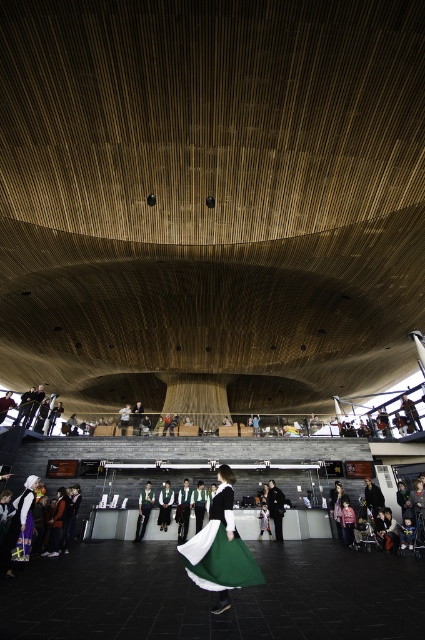
You are a fashion designer attending a presentation where two dresses are displayed at the center of an architectural space with a wooden slatted dome ceiling. The green satin dress at center and the matte black dress at center are both on display. Which dress would you recommend to a client who prefers a more understated, compact design?

The green satin dress at center has a smaller size compared to the matte black dress at center, making it a better choice for someone preferring a more understated, compact design.

You are attending a formal event and see a green satin dress at center. If you want to locate the point at coordinates (220, 548), where would it be on the green satin dress at center?

The point at coordinates (220, 548) is located on the green satin dress at center.